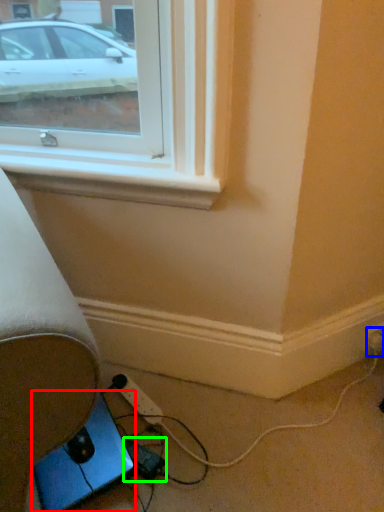
Question: Which object is positioned farthest from gadget (highlighted by a red box)? Select from electric outlet (highlighted by a blue box) and extension cord (highlighted by a green box).

Choices:
 (A) electric outlet
 (B) extension cord

Answer: (A)